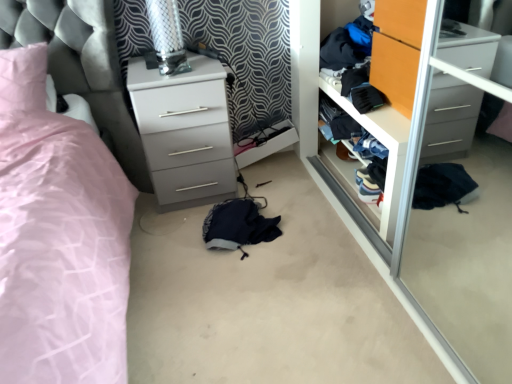
Locate an element on the screen. The image size is (512, 384). free space in front of navy blue fabric at center is located at coordinates (242, 286).